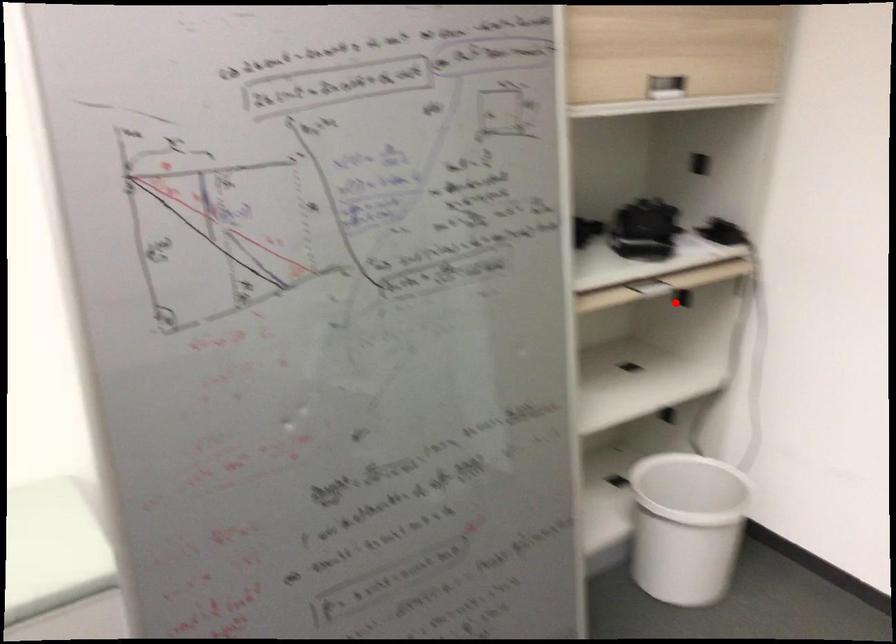
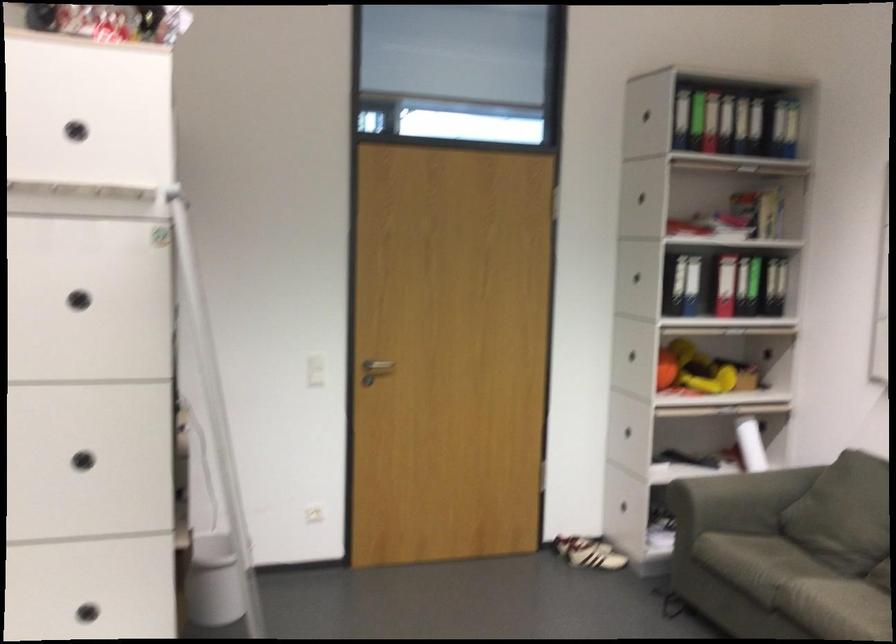
Question: I am providing you with two images of the same scene from different viewpoints. A red point is marked on the first image. At the location where the point appears in image 1, is it still visible in image 2?

Choices:
 (A) Yes
 (B) No

Answer: (B)